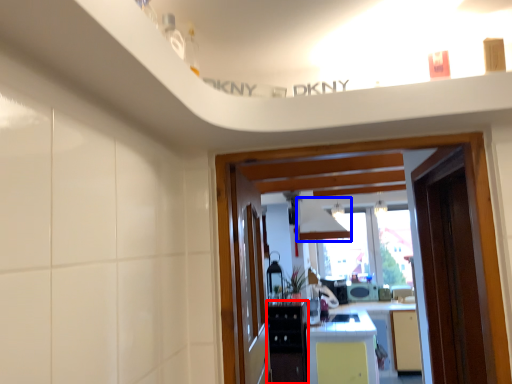
Question: Which object appears closest to the camera in this image, cabinetry (highlighted by a red box) or exhaust hood (highlighted by a blue box)?

Choices:
 (A) cabinetry
 (B) exhaust hood

Answer: (A)